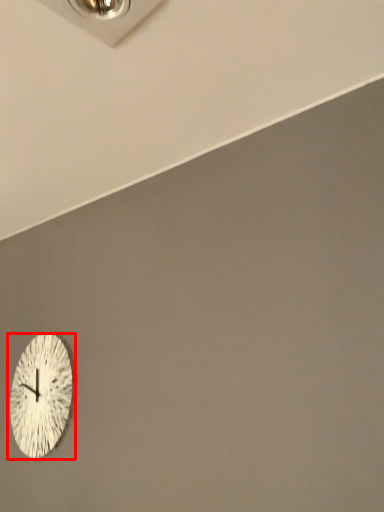
Question: From the image, what is the correct spatial relationship of wall clock (annotated by the red box) in relation to electric outlet?

Choices:
 (A) left
 (B) right

Answer: (A)